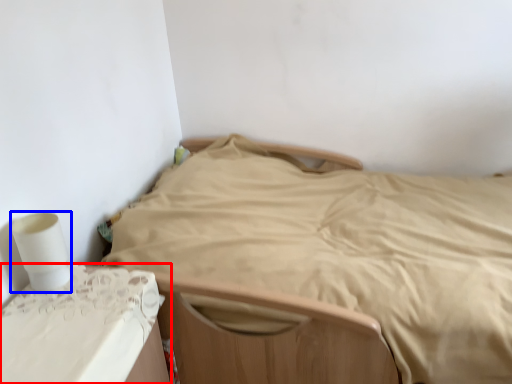
Question: Among these objects, which one is farthest to the camera, furniture (highlighted by a red box) or toilet paper (highlighted by a blue box)?

Choices:
 (A) furniture
 (B) toilet paper

Answer: (B)